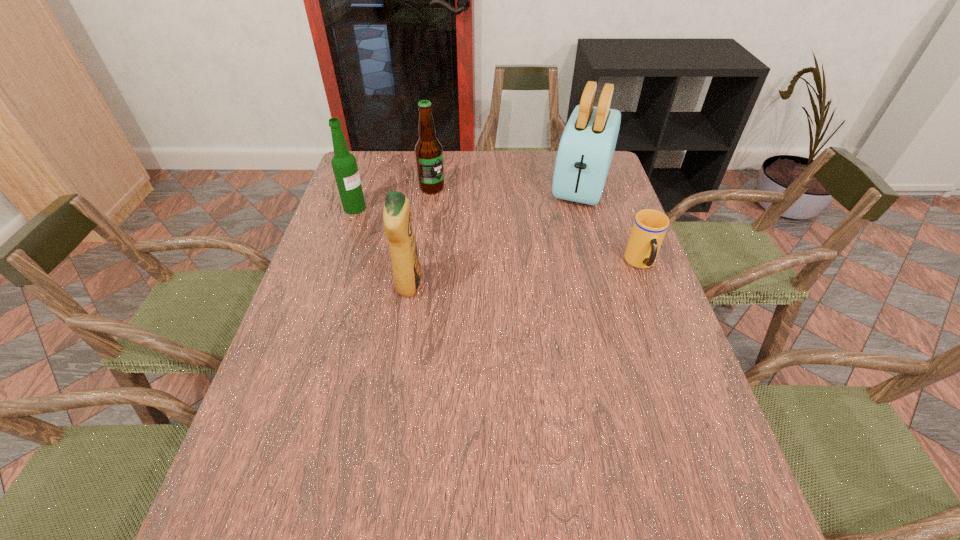
You are a GUI agent. You are given a task and a screenshot of the screen. Output one action in this format:
    pyautogui.click(x=<x>, y=<y>)
    Task: Click on the free location that satisfies the following two spatial constraints: 1. on the back side of the leftmost object; 2. on the right side of the farther beer bottle
    The image size is (960, 540).
    Given the screenshot: What is the action you would take?
    pyautogui.click(x=362, y=188)